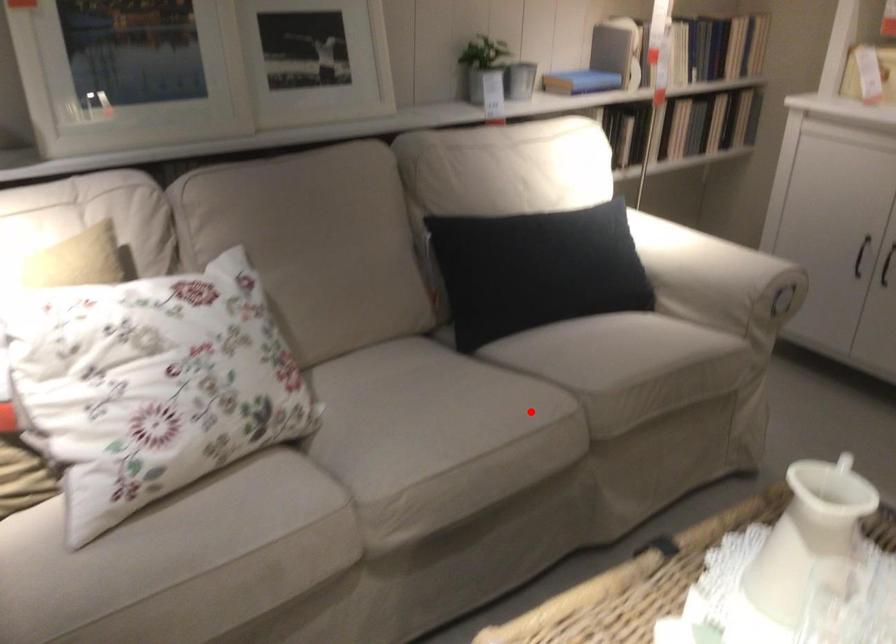
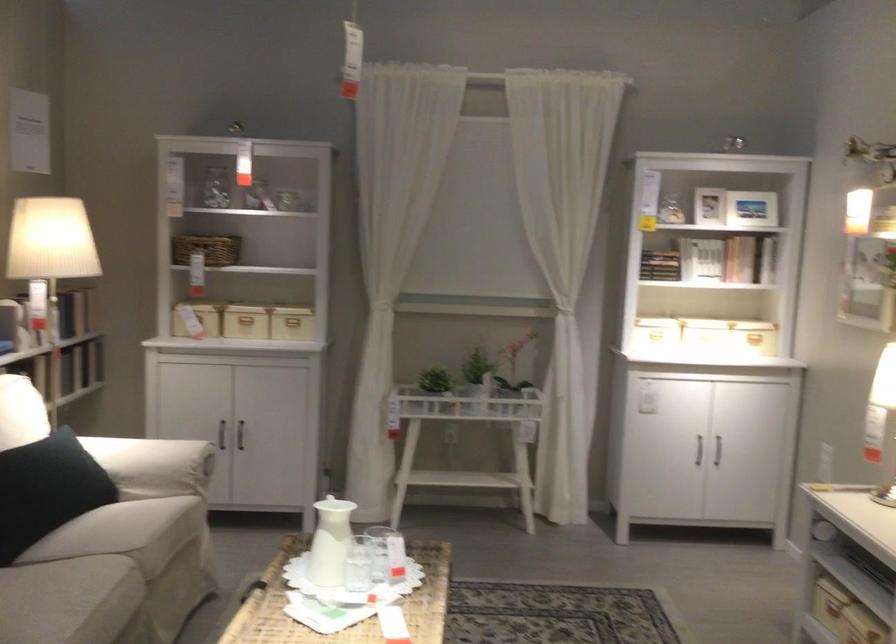
Question: I am providing you with two images of the same scene from different viewpoints. Given a red point in image1, look at the same physical point in image2. Is it:

Choices:
 (A) Closer to the viewpoint
 (B) Farther from the viewpoint

Answer: (B)